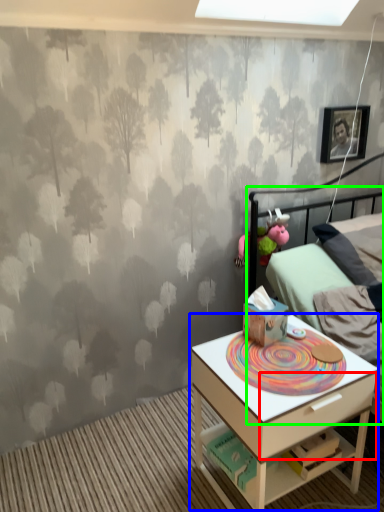
Question: Based on their relative distances, which object is farther from drawer (highlighted by a red box)? Choose from nightstand (highlighted by a blue box) and bed (highlighted by a green box).

Choices:
 (A) nightstand
 (B) bed

Answer: (B)